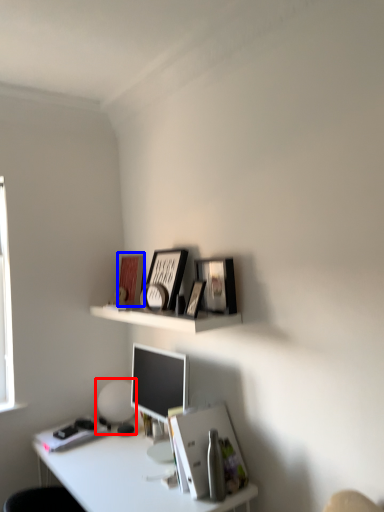
Question: Which of the following is the closest to the observer, table lamp (highlighted by a red box) or book cover (highlighted by a blue box)?

Choices:
 (A) table lamp
 (B) book cover

Answer: (A)